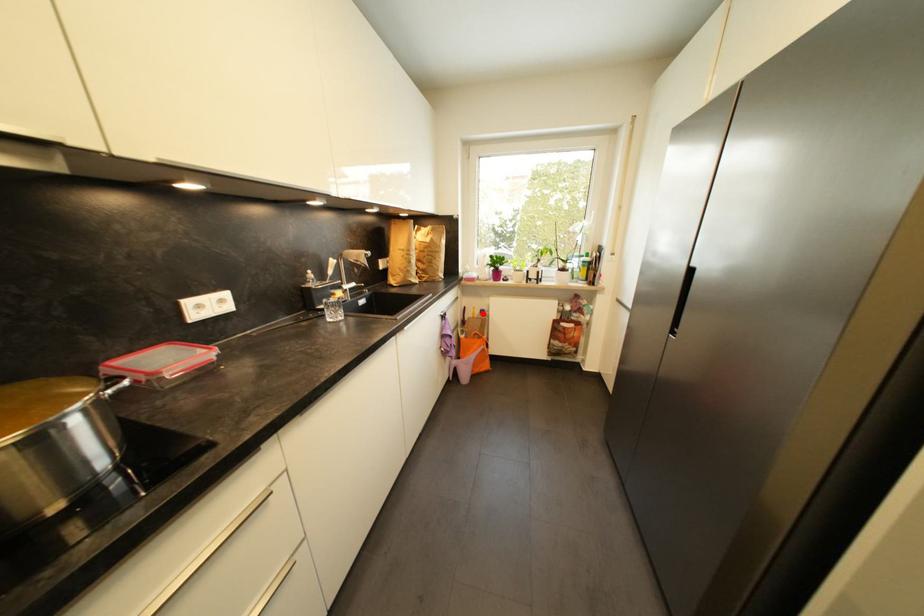
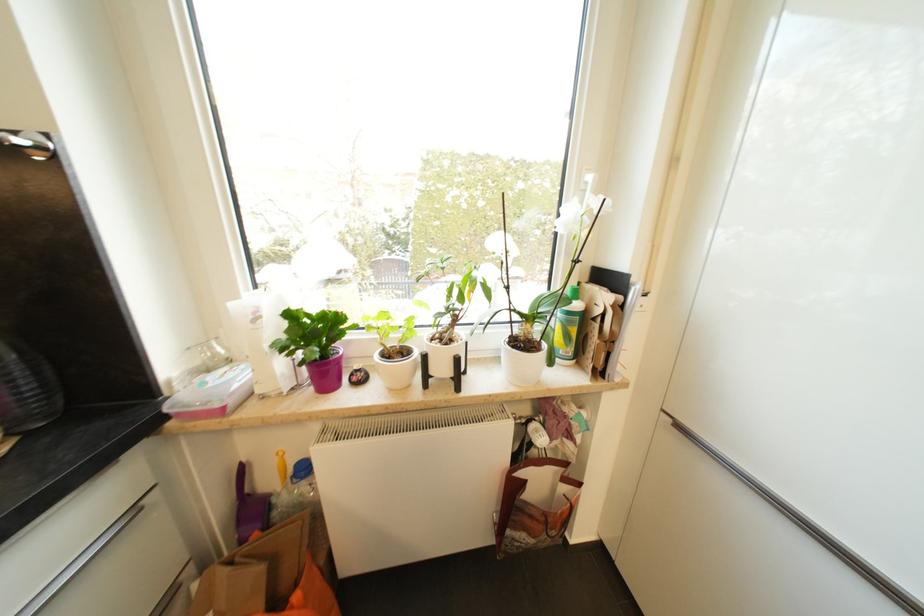
Question: I am providing you with two images of the same scene from different viewpoints. A red point is marked on the first image. Can you still see the location of the red point in image 2?

Choices:
 (A) Yes
 (B) No

Answer: (A)